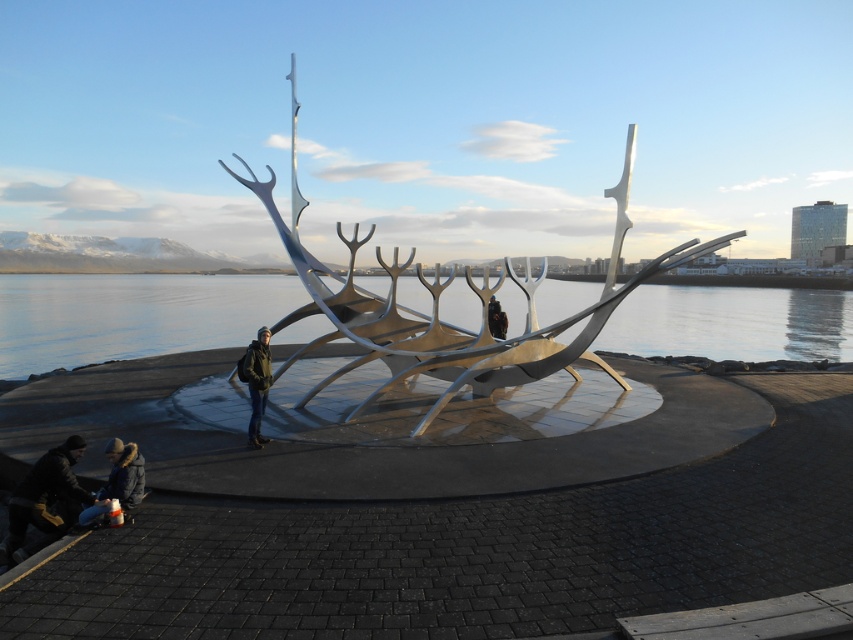
You are standing in front of the Sun Voyager sculpture and want to take a photo that includes both the sculpture and the snowcapped mountains in the background. You notice two points marked on your camera screen at coordinates point (x=599, y=333) and point (x=258, y=420). Which point is closer to you, the photographer?

Point (x=258, y=420) is closer to you because the description states that point (x=599, y=333) is further to the camera than point (x=258, y=420).

You are a photographer planning to take a photo of the black matte person at center and the dark brown leather jacket at lower left. Based on their positions, which object is closer to the camera?

The dark brown leather jacket at lower left is below the black matte person at center, meaning it is closer to the camera.